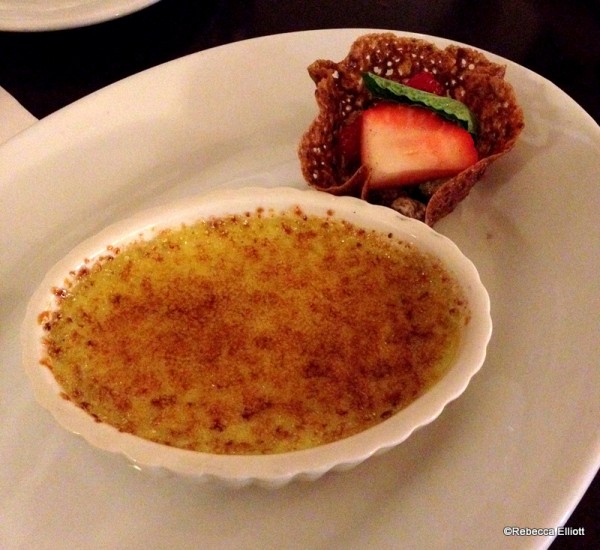
Identify the location of ramekin. Image resolution: width=600 pixels, height=550 pixels. (355, 445).